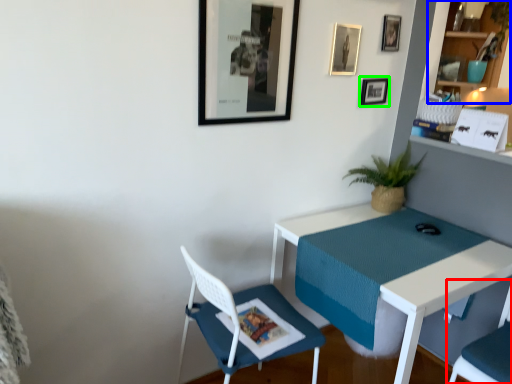
Question: Estimate the real-world distances between objects in this image. Which object is farther from chair (highlighted by a red box), shelf (highlighted by a blue box) or picture frame (highlighted by a green box)?

Choices:
 (A) shelf
 (B) picture frame

Answer: (A)